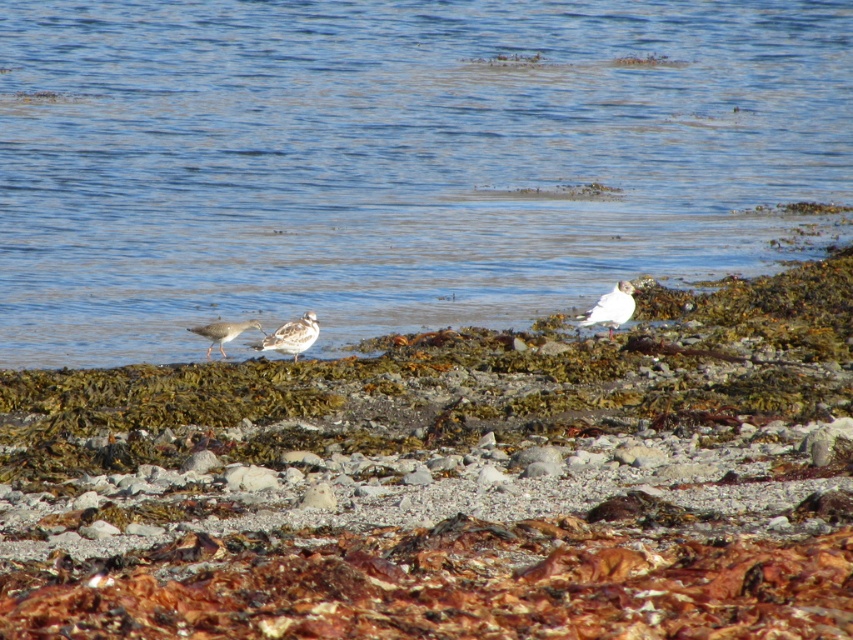
You are standing at the edge of the rocky shoreline looking out at the coastal scene. There is a point marked at coordinates (392, 160). What is located at that point?

The point at coordinates (392, 160) indicates blue water at center.

You are a photographer aiming to capture the white matte bird at right and the speckled gray bird at center in the same frame. Based on their positions, which bird appears higher in the image?

The white matte bird at right appears higher in the image because it is positioned above the speckled gray bird at center.